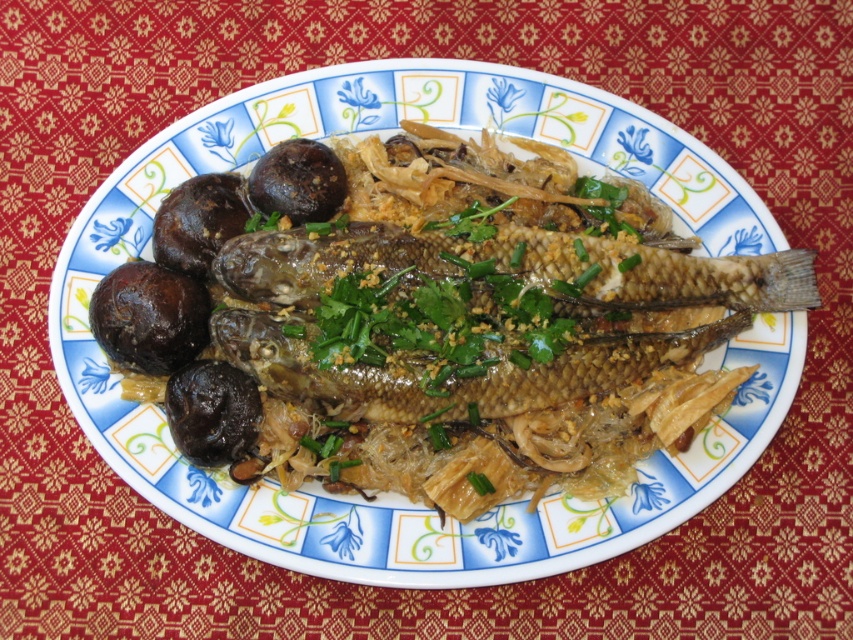
You are a food photographer and need to adjust the lighting to ensure both the brown glossy mushrooms at left and the steamed fish are equally illuminated. Given their distance, will you need to move the light source closer or farther away?

The brown glossy mushrooms at left and the steamed fish are 1.23 meters apart. To ensure equal illumination, you should move the light source closer to the brown glossy mushrooms at left and farther away from the steamed fish, but since they are on the same plate, adjusting the light to be equidistant from both would work best.

You are a food critic evaluating the presentation of this dish. The plate has a blue and white floral design. Based on the placement of the brown glossy mushrooms at left and the golden brown fish at center, which item is positioned lower on the plate?

The brown glossy mushrooms at left are positioned lower on the plate than the golden brown fish at center, as they are located below it.